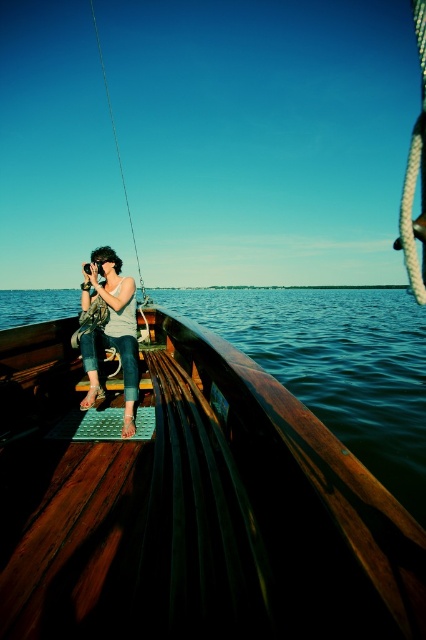
Which is more to the left, matte white tank top at center or metallic wire fishing pole at upper left?

metallic wire fishing pole at upper left is more to the left.

Is point (121, 284) positioned in front of point (104, 76)?

Yes.

Is point (98, 394) positioned in front of point (140, 273)?

Yes, it is in front of point (140, 273).

The height and width of the screenshot is (640, 426). Find the location of `matte white tank top at center`. matte white tank top at center is located at coordinates (111, 330).

Who is higher up, wooden boat at center or metallic wire fishing pole at upper left?

metallic wire fishing pole at upper left

Where is `wooden boat at center`? wooden boat at center is located at coordinates (189, 504).

Identify the location of wooden boat at center. The width and height of the screenshot is (426, 640). (189, 504).

Which is behind, point (43, 440) or point (132, 300)?

Positioned behind is point (132, 300).

Locate an element on the screen. The height and width of the screenshot is (640, 426). wooden boat at center is located at coordinates (189, 504).